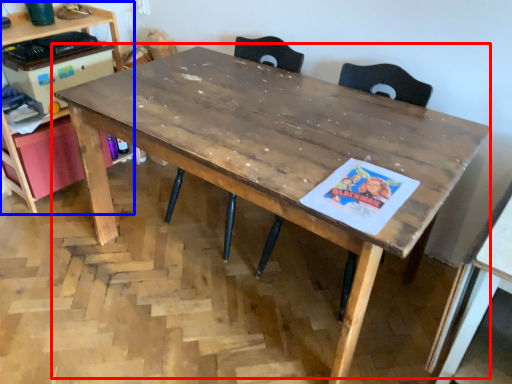
Question: Which object appears farthest to the camera in this image, table (highlighted by a red box) or computer desk (highlighted by a blue box)?

Choices:
 (A) table
 (B) computer desk

Answer: (B)